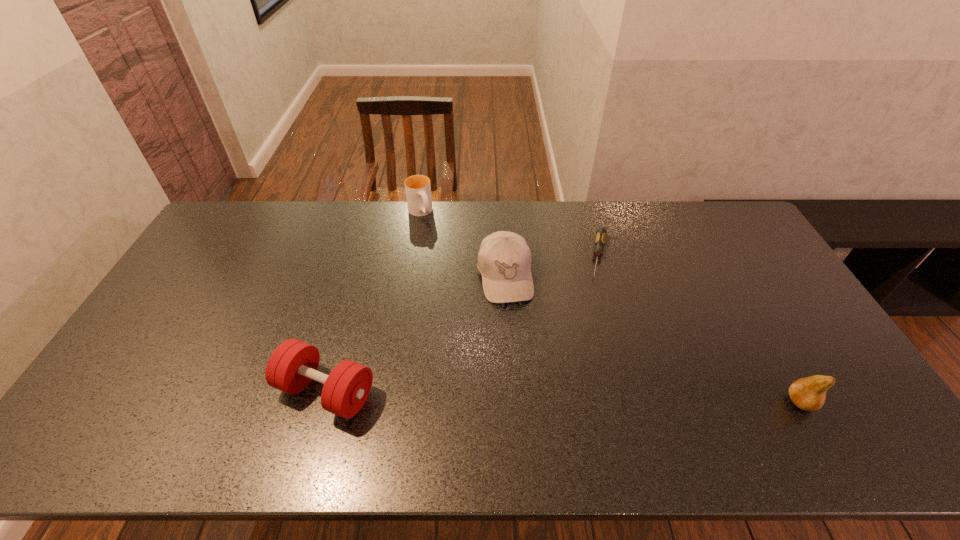
You are a GUI agent. You are given a task and a screenshot of the screen. Output one action in this format:
    pyautogui.click(x=<x>, y=<y>)
    Task: Click on the pear that is at the near edge
    The height and width of the screenshot is (540, 960).
    Given the screenshot: What is the action you would take?
    pyautogui.click(x=809, y=393)

You are a GUI agent. You are given a task and a screenshot of the screen. Output one action in this format:
    pyautogui.click(x=<x>, y=<y>)
    Task: Click on the object present at the right edge
    The width and height of the screenshot is (960, 540).
    Given the screenshot: What is the action you would take?
    pyautogui.click(x=809, y=393)

The height and width of the screenshot is (540, 960). Identify the location of object that is positioned at the near right corner. (809, 393).

In the image, there is a desktop. Where is `vacant area at the far edge`? This screenshot has height=540, width=960. vacant area at the far edge is located at coordinates (663, 234).

In the image, there is a desktop. Where is `vacant region at the near edge`? The height and width of the screenshot is (540, 960). vacant region at the near edge is located at coordinates (215, 395).

This screenshot has height=540, width=960. Identify the location of free point at the left edge. 180,323.

Locate an element on the screen. vacant space at the right edge is located at coordinates 772,287.

The image size is (960, 540). I want to click on blank space at the far right corner of the desktop, so click(704, 221).

Image resolution: width=960 pixels, height=540 pixels. Identify the location of vacant space that's between the dumbbell and the third object from right to left. (416, 334).

I want to click on free spot between the baseball cap and the dumbbell, so click(x=416, y=334).